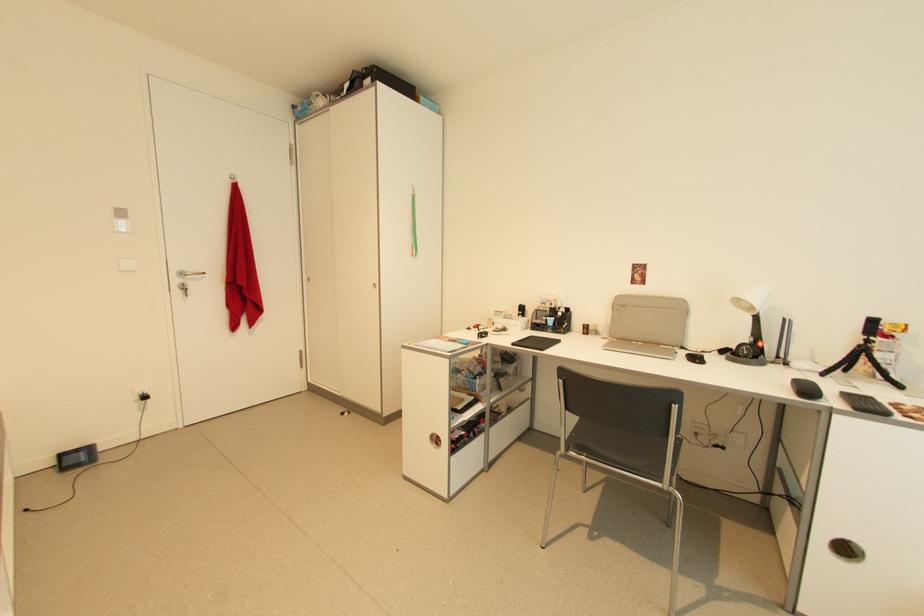
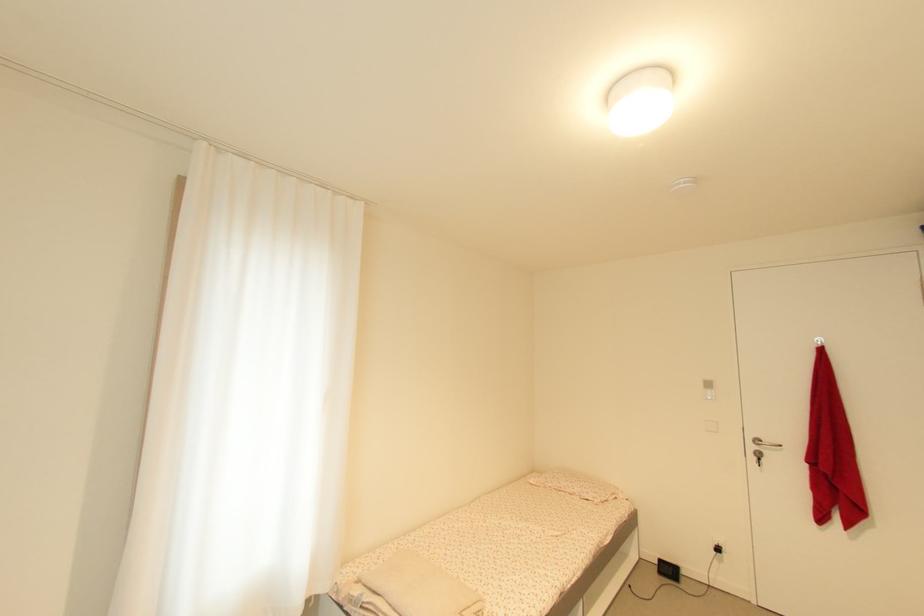
Question: The camera is either moving clockwise (left) or counter-clockwise (right) around the object. The first image is from the beginning of the video and the second image is from the end. Is the camera moving left or right when shooting the video?

Choices:
 (A) Left
 (B) Right

Answer: (B)